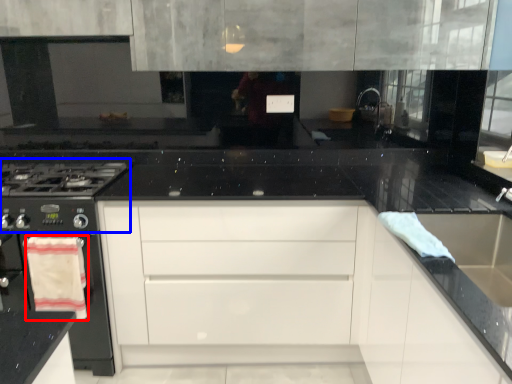
Question: Which point is further to the camera, material (highlighted by a red box) or gas stove (highlighted by a blue box)?

Choices:
 (A) material
 (B) gas stove

Answer: (A)